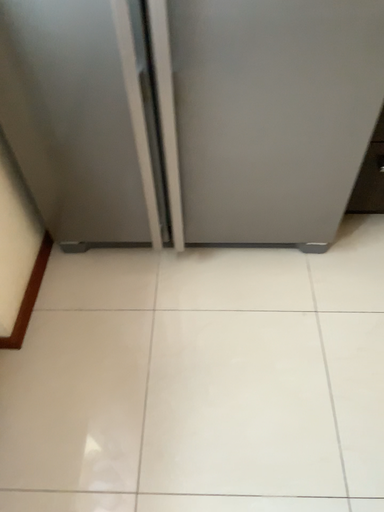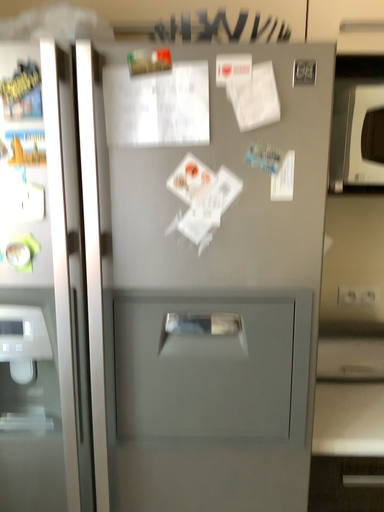
Question: How did the camera likely rotate when shooting the video?

Choices:
 (A) rotated upward
 (B) rotated downward

Answer: (A)